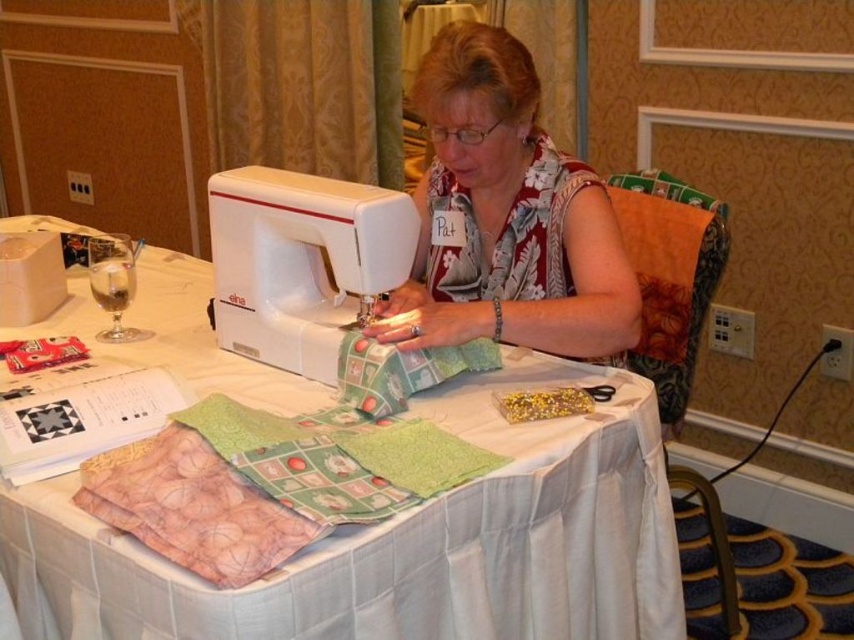
You are standing in front of the sewing table and want to place a 30 inch ruler on the white cloth table at center. Can the ruler fit on the table without hanging off the edge?

The distance between the white cloth table at center and the viewer is 33.87 inches. Since the ruler is 30 inches long, it can fit on the table as the table is longer than the ruler.

You are standing in the room where the woman is sewing. If you want to walk directly to the white cloth table at center, which direction should you head towards?

The white cloth table at center is located at point [402,544], so you should head towards that coordinate to reach it directly.

You are a photographer wanting to capture the woman and her sewing machine. Since the white cloth table at center and the white floral blouse at center are both white, which one should you focus on to ensure proper exposure without overexposing the image?

The white cloth table at center is in front of the white floral blouse at center, so focusing on the table will help avoid overexposure as it is closer and the camera can adjust exposure based on the foreground object.